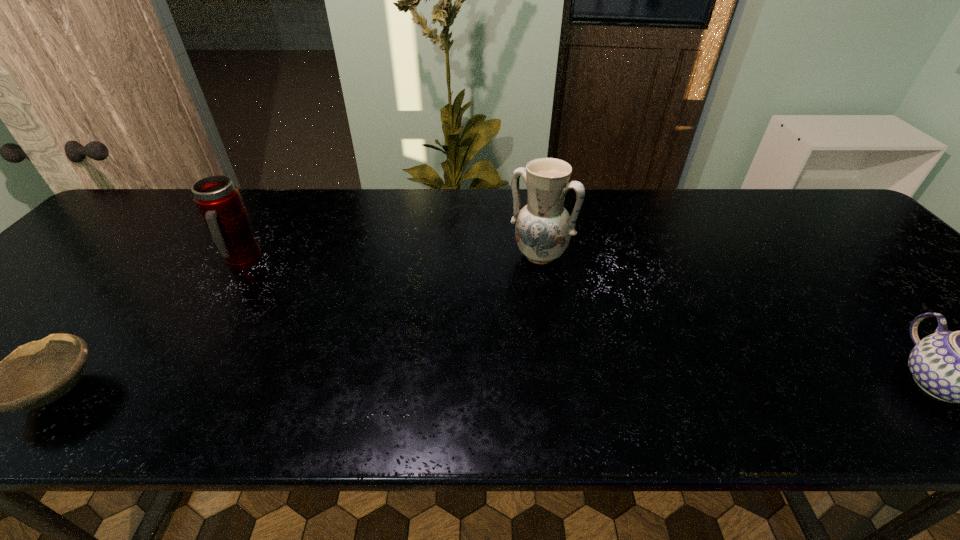
The height and width of the screenshot is (540, 960). I want to click on free spot on the desktop that is between the shortest object and the second shortest object and is positioned on the side with the handle of the second object from left to right, so click(x=374, y=389).

Identify the location of free space on the desktop that is between the bowl and the rightmost object and is positioned on either side of the pottery. (x=457, y=388).